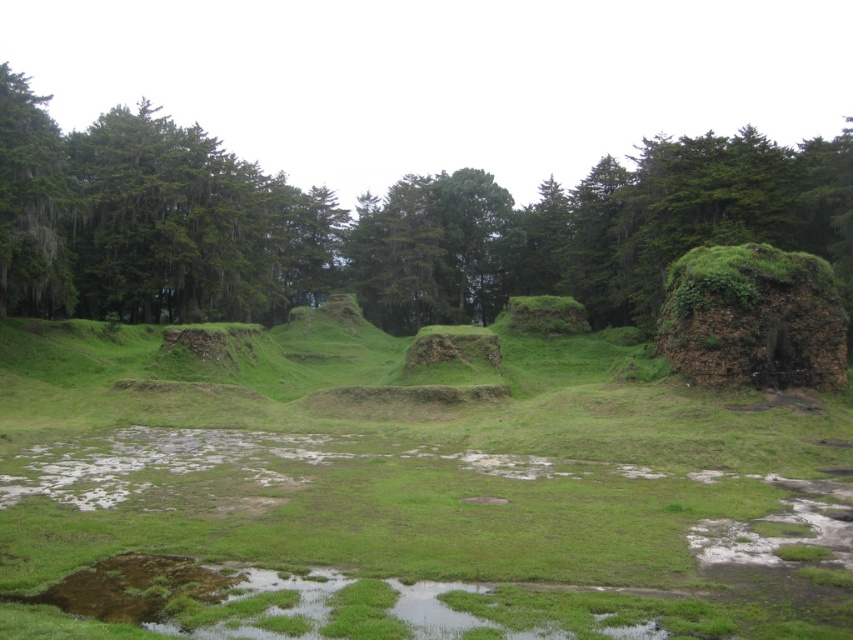
Which is more to the left, green leafy tree at center or green mossy rock at right?

From the viewer's perspective, green mossy rock at right appears more on the left side.

Can you confirm if green leafy tree at center is taller than green mossy rock at right?

Yes, green leafy tree at center is taller than green mossy rock at right.

Locate an element on the screen. The height and width of the screenshot is (640, 853). green leafy tree at center is located at coordinates (379, 225).

Identify the location of green leafy tree at center. (379, 225).

Can you confirm if green grassy mound at center is positioned below green mossy rock at right?

Yes.

Is point (805, 602) behind point (833, 362)?

That is False.

Identify the location of green grassy mound at center. (405, 488).

The image size is (853, 640). I want to click on green grassy mound at center, so click(x=405, y=488).

Is point (346, 493) positioned behind point (9, 122)?

No, (346, 493) is closer to viewer.

The width and height of the screenshot is (853, 640). Identify the location of green grassy mound at center. (405, 488).